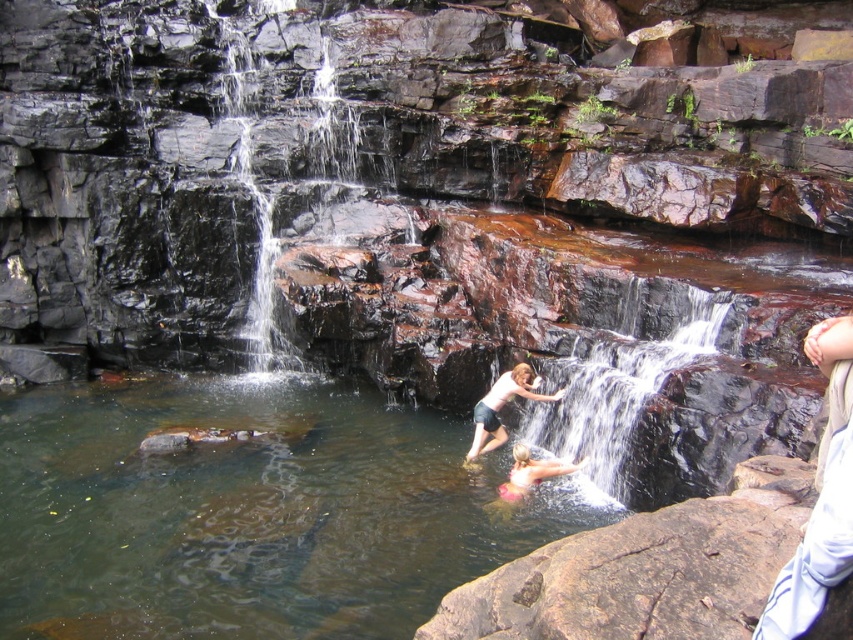
In the scene shown: You are planning to set up a picnic blanket between the white cotton shirt at right and the pink fabric at lower center. Given that the picnic blanket is 1.2 meters wide, will it fit between them without overlapping either object?

The white cotton shirt at right is taller than the pink fabric at lower center, but the spatial relationship between their positions isn

You are planning to set up a picnic blanket at the pink fabric at lower center. Considering the smooth rock waterfall at center is nearby, which direction should you place the picnic blanket to avoid getting wet from the waterfall spray?

The smooth rock waterfall at center is positioned on the right side of the pink fabric at lower center. To avoid getting wet from the waterfall spray, place the picnic blanket to the left side of the pink fabric at lower center, away from the waterfall.